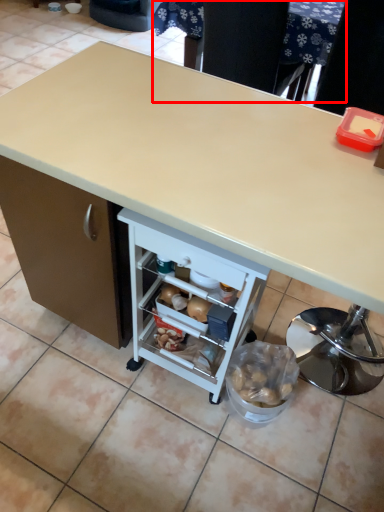
Question: From the image, what is the correct spatial relationship of table (annotated by the red box) in relation to desk?

Choices:
 (A) left
 (B) right

Answer: (B)